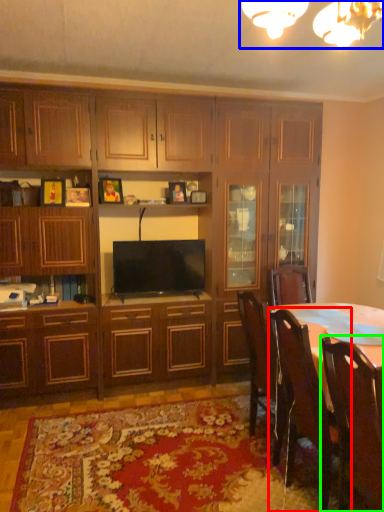
Question: Which object is the farthest from chair (highlighted by a red box)? Choose among these: light fixture (highlighted by a blue box) or chair (highlighted by a green box).

Choices:
 (A) light fixture
 (B) chair

Answer: (A)